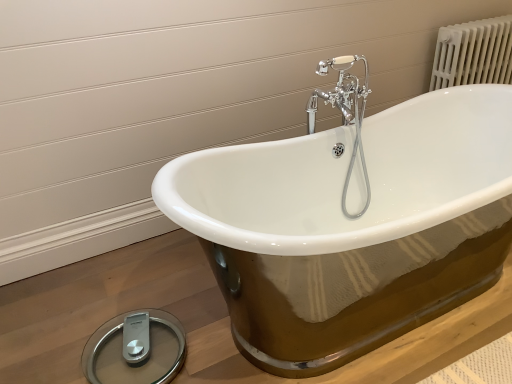
Question: Considering the positions of point (109, 367) and point (492, 235), is point (109, 367) closer or farther from the camera than point (492, 235)?

Choices:
 (A) farther
 (B) closer

Answer: (B)

Question: Is silver/glass scale at lower left situated inside white porcelain bathtub at center or outside?

Choices:
 (A) inside
 (B) outside

Answer: (A)

Question: Estimate the real-world distances between objects in this image. Which object is farther from the white porcelain bathtub at center?

Choices:
 (A) silver/glass scale at lower left
 (B) chrome/metallic faucet at upper center

Answer: (A)

Question: Estimate the real-world distances between objects in this image. Which object is closer to the chrome/metallic faucet at upper center?

Choices:
 (A) white porcelain bathtub at center
 (B) silver/glass scale at lower left

Answer: (A)